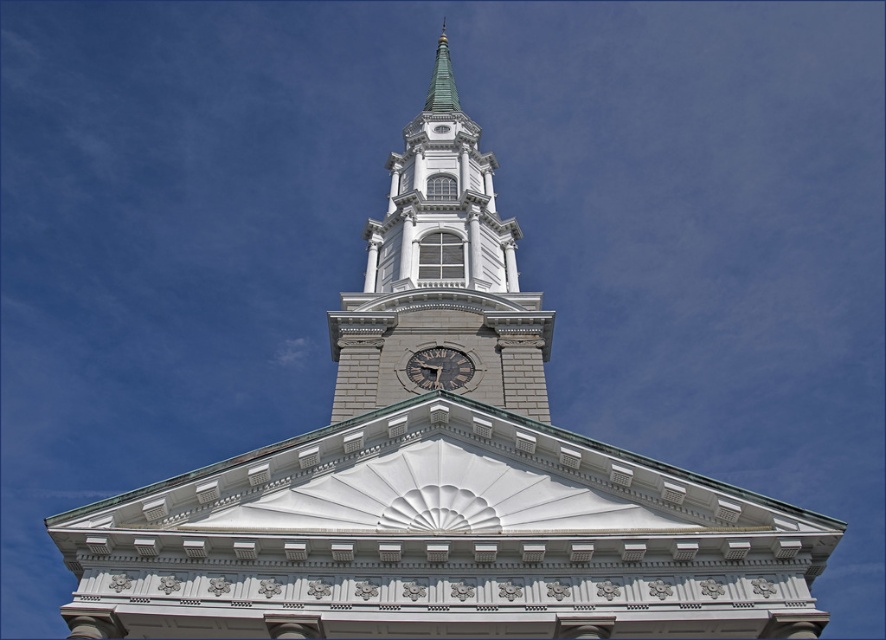
You are an architect assessing the structural integrity of the building. You need to determine which object occupies more horizontal space between the white stone clock tower at center and the dark brown wooden clock at center. Which one is wider?

The white stone clock tower at center is wider than the dark brown wooden clock at center because its width surpasses the latter according to the description.

You are an architect designing a model of the building. You have both the white stone clock tower at center and the dark brown wooden clock at center. Which one should you scale down more to maintain the original proportions?

The white stone clock tower at center is larger in size than the dark brown wooden clock at center, so you should scale down the dark brown wooden clock at center more to maintain the original proportions.

You are standing in front of the classical building and want to know which object is higher between the white stone clock tower at center and the dark brown wooden clock at center. Based on the scene, can you determine which one is taller?

The white stone clock tower at center is positioned over the dark brown wooden clock at center, so the white stone clock tower at center is taller than the dark brown wooden clock at center.